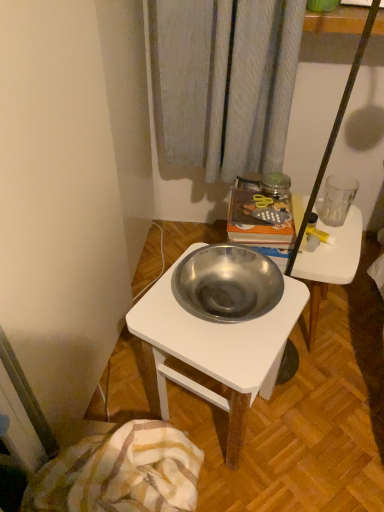
Question: Can you confirm if metallic white desk at center is bigger than metallic silver bowl at center?

Choices:
 (A) no
 (B) yes

Answer: (B)

Question: Is metallic white desk at center to the left of metallic silver bowl at center from the viewer's perspective?

Choices:
 (A) no
 (B) yes

Answer: (B)

Question: Is metallic white desk at center further to camera compared to metallic silver bowl at center?

Choices:
 (A) yes
 (B) no

Answer: (B)

Question: From the image's perspective, does metallic white desk at center appear lower than metallic silver bowl at center?

Choices:
 (A) no
 (B) yes

Answer: (B)

Question: Is metallic white desk at center looking in the opposite direction of metallic silver bowl at center?

Choices:
 (A) no
 (B) yes

Answer: (A)

Question: From a real-world perspective, is metallic white desk at center over metallic silver bowl at center?

Choices:
 (A) yes
 (B) no

Answer: (A)

Question: From the image's perspective, would you say plaid cotton blanket at lower left is shown under metallic white desk at center?

Choices:
 (A) yes
 (B) no

Answer: (A)

Question: Is plaid cotton blanket at lower left not close to metallic white desk at center?

Choices:
 (A) yes
 (B) no

Answer: (B)

Question: Is plaid cotton blanket at lower left not within metallic white desk at center?

Choices:
 (A) yes
 (B) no

Answer: (A)

Question: Is plaid cotton blanket at lower left wider than metallic white desk at center?

Choices:
 (A) no
 (B) yes

Answer: (B)

Question: Would you say metallic white desk at center is part of plaid cotton blanket at lower left's contents?

Choices:
 (A) yes
 (B) no

Answer: (B)

Question: Is plaid cotton blanket at lower left looking in the opposite direction of metallic white desk at center?

Choices:
 (A) no
 (B) yes

Answer: (A)

Question: Does metallic silver bowl at center come behind plaid cotton blanket at lower left?

Choices:
 (A) yes
 (B) no

Answer: (A)